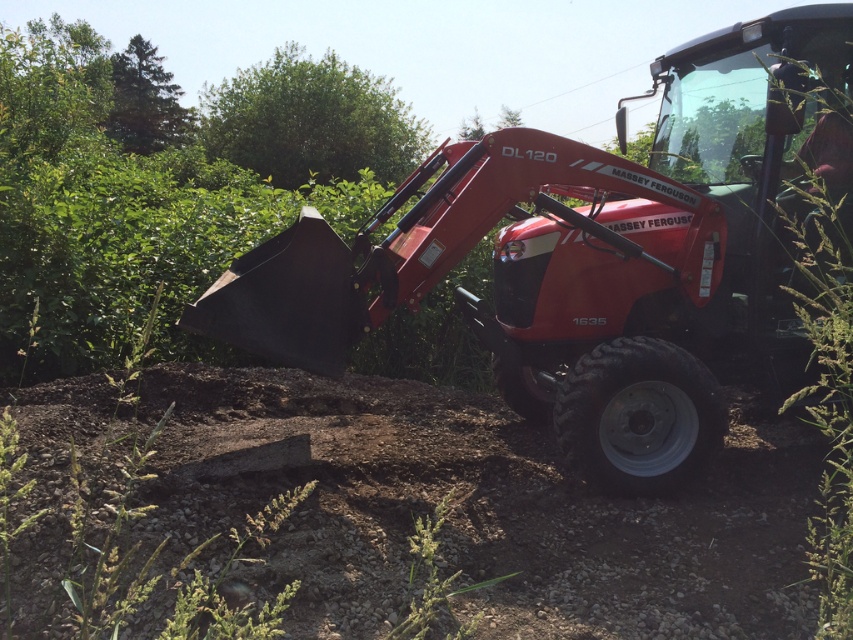
Question: Does brown gravel dirt track at lower center appear on the right side of metallic red tractor at center?

Choices:
 (A) no
 (B) yes

Answer: (A)

Question: Can you confirm if brown gravel dirt track at lower center is smaller than metallic red tractor at center?

Choices:
 (A) no
 (B) yes

Answer: (B)

Question: In this image, where is brown gravel dirt track at lower center located relative to metallic red tractor at center?

Choices:
 (A) below
 (B) above

Answer: (A)

Question: Which point is farther from the camera taking this photo?

Choices:
 (A) (x=549, y=163)
 (B) (x=233, y=410)

Answer: (B)

Question: Among these points, which one is nearest to the camera?

Choices:
 (A) (367, 468)
 (B) (583, 250)

Answer: (A)